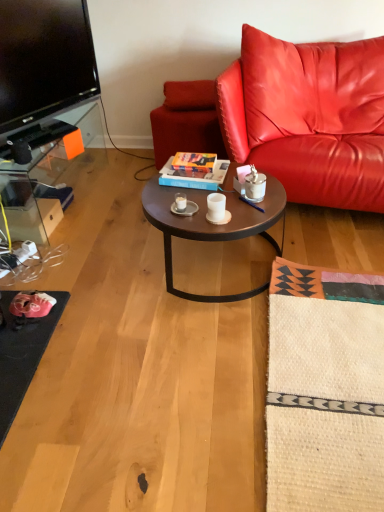
Where is `vacant space to the left of white matte cup at center, which is counted as the first coffee cup, starting from the right`? Image resolution: width=384 pixels, height=512 pixels. vacant space to the left of white matte cup at center, which is counted as the first coffee cup, starting from the right is located at coordinates (188, 210).